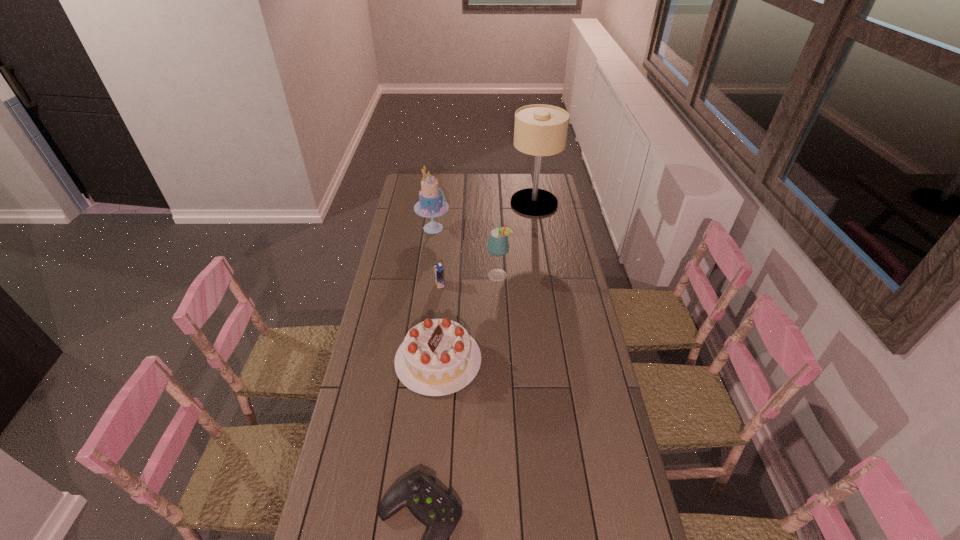
At what (x,y) coordinates should I click in order to perform the action: click on vacant space located 0.110m on the right of the fourth tallest object. Please return your answer as a coordinate pair (x, y). This screenshot has width=960, height=540. Looking at the image, I should click on (511, 360).

Locate an element on the screen. This screenshot has height=540, width=960. vacant space located on the back of the fifth tallest object is located at coordinates (444, 233).

The width and height of the screenshot is (960, 540). I want to click on object present at the far edge, so click(x=540, y=130).

You are a GUI agent. You are given a task and a screenshot of the screen. Output one action in this format:
    pyautogui.click(x=<x>, y=<y>)
    Task: Click on the cake at the left edge
    
    Given the screenshot: What is the action you would take?
    pyautogui.click(x=432, y=203)

I want to click on birthday cake that is at the left edge, so click(x=438, y=357).

Identify the location of object located in the right edge section of the desktop. (540, 130).

At what (x,y) coordinates should I click in order to perform the action: click on object situated at the far right corner. Please return your answer as a coordinate pair (x, y). Looking at the image, I should click on (540, 130).

The width and height of the screenshot is (960, 540). Identify the location of vacant space at the far edge. (x=480, y=183).

At what (x,y) coordinates should I click in order to perform the action: click on vacant space at the left edge. Please return your answer as a coordinate pair (x, y). This screenshot has width=960, height=540. Looking at the image, I should click on (417, 196).

Locate an element on the screen. The image size is (960, 540). blank area at the right edge is located at coordinates (566, 266).